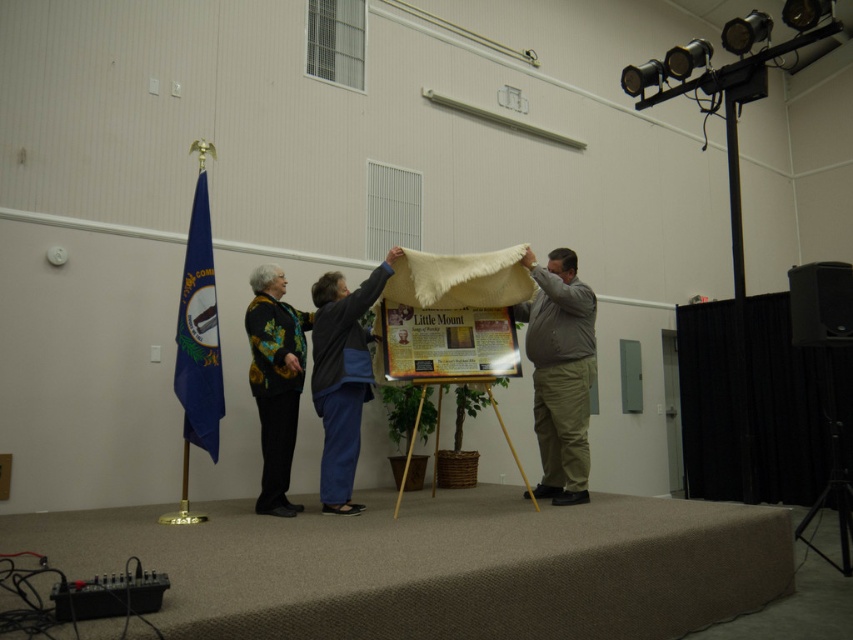
Question: Observing the image, what is the correct spatial positioning of white woolen cloth at center in reference to black plastic speaker at right?

Choices:
 (A) above
 (B) below

Answer: (A)

Question: Can you confirm if matte paper bulletin board at center is smaller than black plastic speaker at right?

Choices:
 (A) yes
 (B) no

Answer: (B)

Question: Among these points, which one is farthest from the camera?

Choices:
 (A) (351, 432)
 (B) (270, 376)

Answer: (B)

Question: Which point is closer to the camera?

Choices:
 (A) floral-patterned sweater at center
 (B) blue fabric flag at left
 (C) khaki cotton pants at center

Answer: (A)

Question: Is khaki cotton pants at center below white woolen cloth at center?

Choices:
 (A) yes
 (B) no

Answer: (A)

Question: Considering the real-world distances, which object is farthest from the black plastic speaker at right?

Choices:
 (A) blue fabric flag at left
 (B) white woolen cloth at center

Answer: (A)